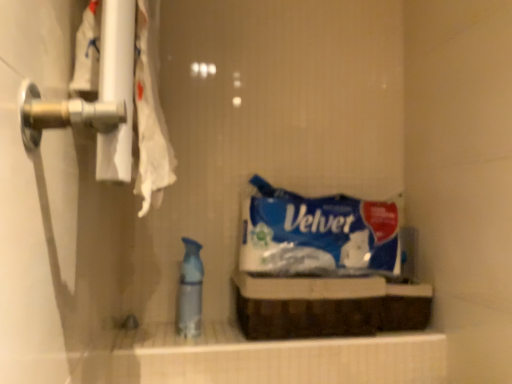
Question: Considering the positions of blue paper towel at center and translucent plastic spray bottle at center in the image, is blue paper towel at center taller or shorter than translucent plastic spray bottle at center?

Choices:
 (A) short
 (B) tall

Answer: (A)

Question: Is blue paper towel at center bigger or smaller than translucent plastic spray bottle at center?

Choices:
 (A) small
 (B) big

Answer: (B)

Question: Is blue paper towel at center wider or thinner than translucent plastic spray bottle at center?

Choices:
 (A) thin
 (B) wide

Answer: (B)

Question: Based on their sizes in the image, would you say translucent plastic spray bottle at center is bigger or smaller than blue paper towel at center?

Choices:
 (A) big
 (B) small

Answer: (B)

Question: Considering the positions of translucent plastic spray bottle at center and blue paper towel at center in the image, is translucent plastic spray bottle at center taller or shorter than blue paper towel at center?

Choices:
 (A) tall
 (B) short

Answer: (A)

Question: Considering the relative positions of translucent plastic spray bottle at center and blue paper towel at center in the image provided, is translucent plastic spray bottle at center to the left or to the right of blue paper towel at center?

Choices:
 (A) right
 (B) left

Answer: (B)

Question: Considering the positions of point (185, 329) and point (269, 195), is point (185, 329) closer or farther from the camera than point (269, 195)?

Choices:
 (A) closer
 (B) farther

Answer: (A)